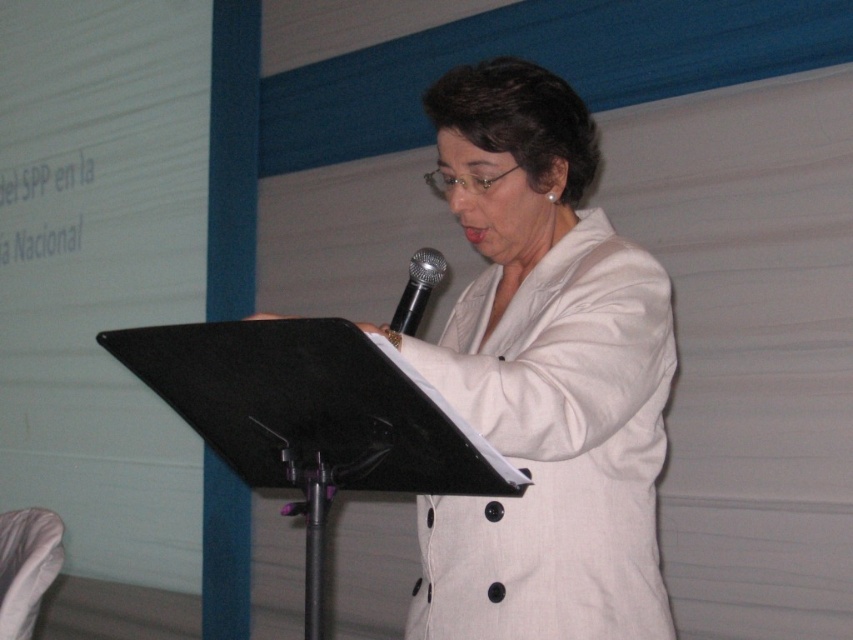
You are an event organizer setting up a stage for a speaker. You have a white fabric coat at center and a black metallic microphone at center. Which object takes up more space on the stage?

The white fabric coat at center is bigger than the black metallic microphone at center, so it takes up more space on the stage.

You are an event organizer who needs to adjust the lighting for the presentation. Since the white fabric coat at center is in front of the black metallic microphone at center, which object should you focus the spotlight on to ensure the presenter is clearly visible?

You should focus the spotlight on the white fabric coat at center because it is in front of the black metallic microphone at center, ensuring the presenter is highlighted while the microphone remains visible but not the main focus.

You are an event organizer and need to place a name tag on the white fabric coat at center. What are the coordinates where you should place it?

The white fabric coat at center is located at coordinates point (543, 378), so the name tag should be placed at those coordinates.